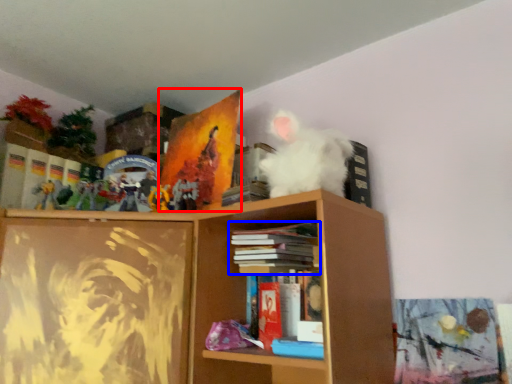
Question: Among these objects, which one is farthest to the camera, paperback book (highlighted by a red box) or book (highlighted by a blue box)?

Choices:
 (A) paperback book
 (B) book

Answer: (A)